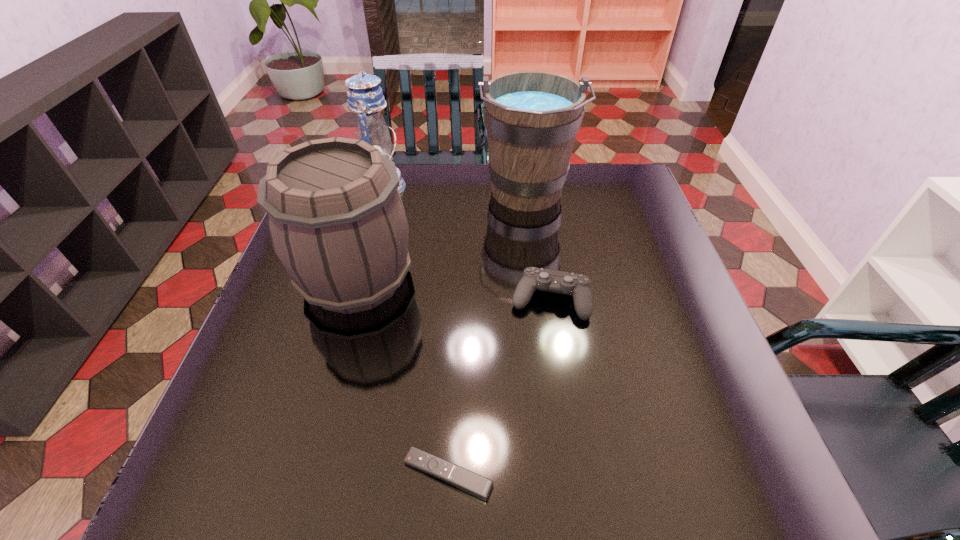
This screenshot has height=540, width=960. In order to click on lantern in this screenshot , I will do `click(365, 97)`.

Where is `the farther wine bucket`? This screenshot has height=540, width=960. the farther wine bucket is located at coordinates (532, 118).

This screenshot has height=540, width=960. What are the coordinates of `the left wine bucket` in the screenshot? It's located at (336, 220).

The image size is (960, 540). Find the location of `the second shortest object`. the second shortest object is located at coordinates (577, 285).

In order to click on the shortest object in this screenshot , I will do `click(464, 479)`.

Find the location of a particular element. the nearest object is located at coordinates tap(464, 479).

This screenshot has height=540, width=960. Find the location of `vacant area situated on the front-facing side of the lantern`. vacant area situated on the front-facing side of the lantern is located at coordinates (470, 187).

Where is `free region located with a handle on the side of the right wine bucket`? The image size is (960, 540). free region located with a handle on the side of the right wine bucket is located at coordinates (536, 265).

Locate an element on the screen. This screenshot has height=540, width=960. vacant point located 0.130m on the right of the left wine bucket is located at coordinates (469, 279).

Identify the location of free space located 0.150m on the right of the fourth tallest object. The image size is (960, 540). (653, 300).